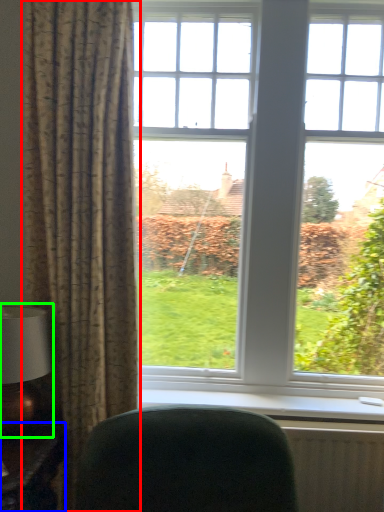
Question: Which object is the closest to the curtain (highlighted by a red box)? Choose among these: table (highlighted by a blue box) or table lamp (highlighted by a green box).

Choices:
 (A) table
 (B) table lamp

Answer: (B)